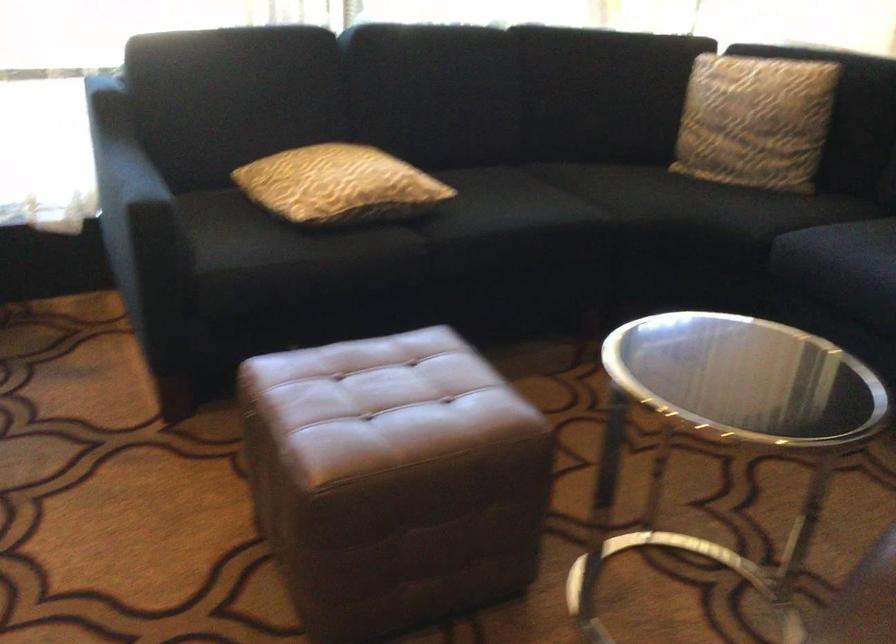
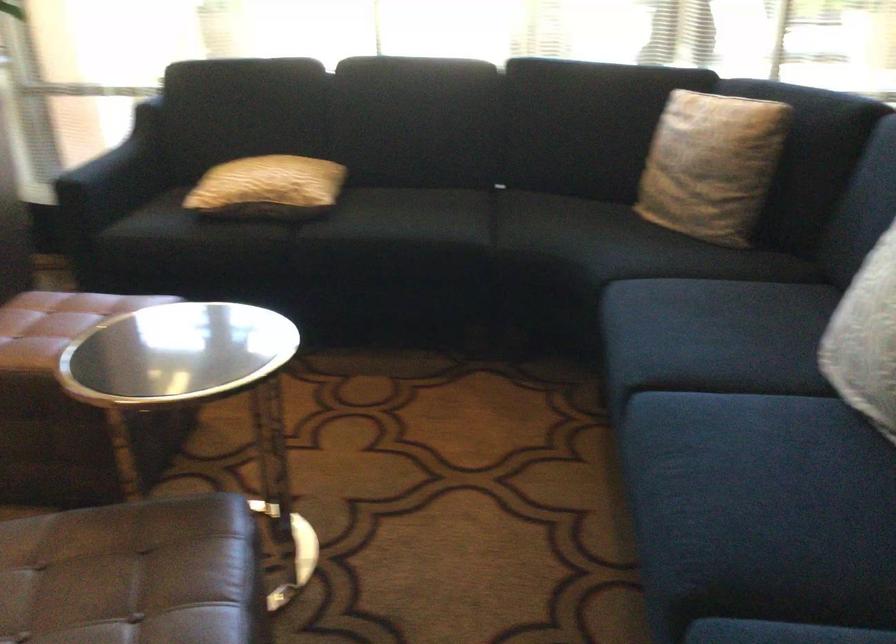
The point at (780, 117) is marked in the first image. Where is the corresponding point in the second image?

(711, 165)